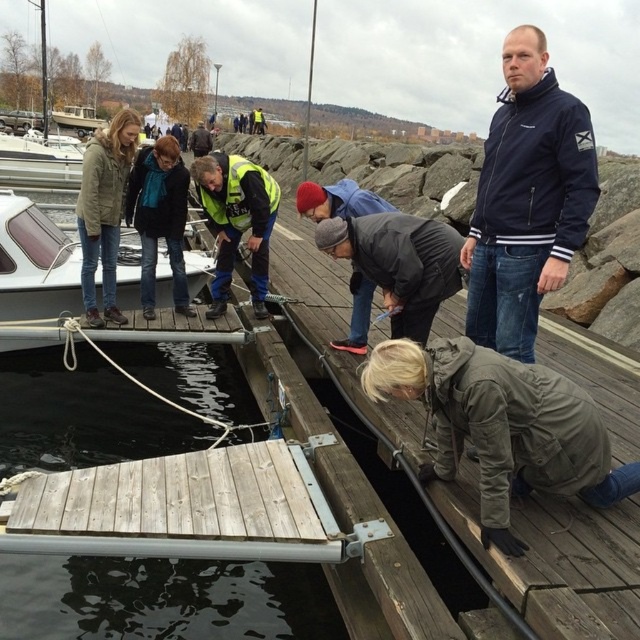
Is dark wood water at lower left above reflective yellow safety vest at center?

No.

Can you confirm if dark wood water at lower left is positioned to the right of reflective yellow safety vest at center?

Indeed, dark wood water at lower left is positioned on the right side of reflective yellow safety vest at center.

The image size is (640, 640). What do you see at coordinates (163, 600) in the screenshot?
I see `dark wood water at lower left` at bounding box center [163, 600].

Identify the location of dark wood water at lower left. The image size is (640, 640). (163, 600).

Can you confirm if gray matte jacket at lower right is taller than matte black jacket at upper left?

Result: In fact, gray matte jacket at lower right may be shorter than matte black jacket at upper left.

Consider the image. Who is lower down, gray matte jacket at lower right or matte black jacket at upper left?

gray matte jacket at lower right

Describe the element at coordinates (502, 426) in the screenshot. I see `gray matte jacket at lower right` at that location.

This screenshot has height=640, width=640. What are the coordinates of `gray matte jacket at lower right` in the screenshot? It's located at (502, 426).

Who is positioned more to the left, navy blue jacket at upper right or reflective yellow safety vest at center?

reflective yellow safety vest at center

Which of these two, navy blue jacket at upper right or reflective yellow safety vest at center, stands shorter?

Standing shorter between the two is reflective yellow safety vest at center.

Where is `navy blue jacket at upper right`? Image resolution: width=640 pixels, height=640 pixels. navy blue jacket at upper right is located at coordinates (525, 198).

The width and height of the screenshot is (640, 640). Find the location of `navy blue jacket at upper right`. navy blue jacket at upper right is located at coordinates (525, 198).